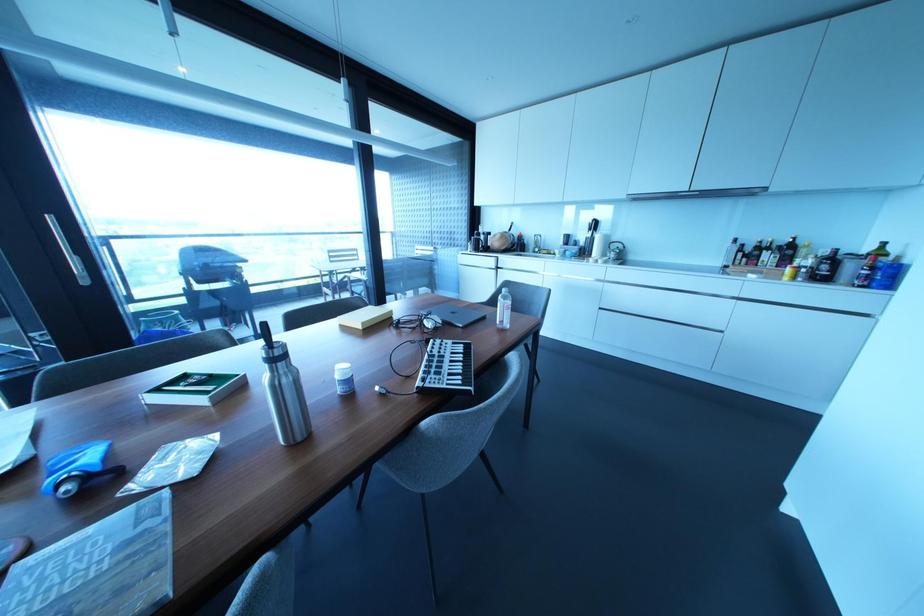
Find where to slid the sliding door handle. Please return your answer as a coordinate pair (x, y).

(67, 251)